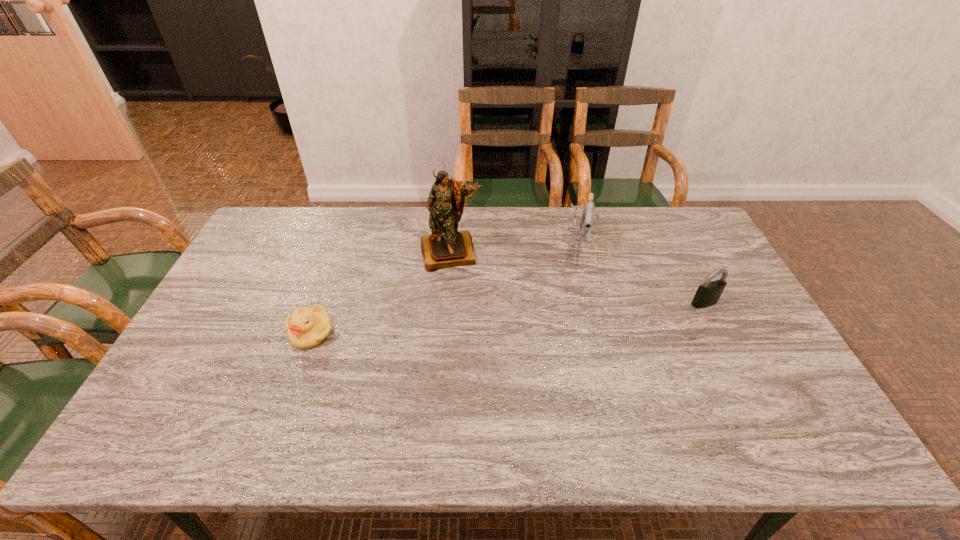
Find the location of a particular element. This screenshot has height=540, width=960. vacant space on the desktop that is between the leftmost object and the rightmost object and is positioned at the barrel end of the gun is located at coordinates (570, 313).

You are a GUI agent. You are given a task and a screenshot of the screen. Output one action in this format:
    pyautogui.click(x=<x>, y=<y>)
    Task: Click on the vacant space on the desktop that is between the duckling and the third farthest object and is positioned on the front-facing side of the third object from right to left
    This screenshot has width=960, height=540.
    Given the screenshot: What is the action you would take?
    pyautogui.click(x=462, y=321)